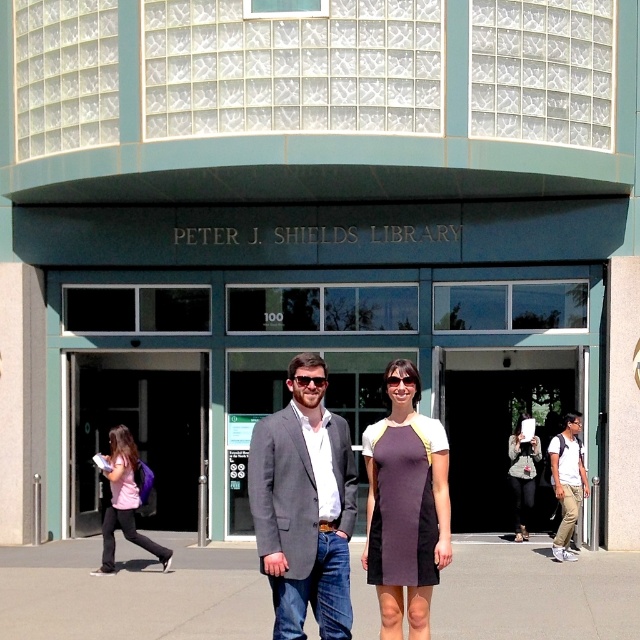
You are a visitor approaching the entrance of the Peter J. Shields Library. You notice a pink fabric shirt at lower left and a light brown leather backpack at right. Which object is closer to you as you stand at the entrance?

The pink fabric shirt at lower left is closer to you because it is in front of the light brown leather backpack at right.

You are standing outside the Peter J. Shields Library entrance. You see a dark purple jersey dress at center. If you want to reach the dress quickly, should you walk towards the library entrance or away from it?

You should walk towards the library entrance to reach the dark purple jersey dress at center because it is located 6.44 meters away from the viewer, so moving closer to the entrance would reduce the distance.

From the picture: You are standing at the entrance of the Peter J. Shields Library and notice two points marked on the facade. The first point is at coordinates point (112, 564) and the second is at point (577, 452). Which point is nearer to your current position?

Point (112, 564) is closer to the camera than point (577, 452), so the first point is nearer to your current position.